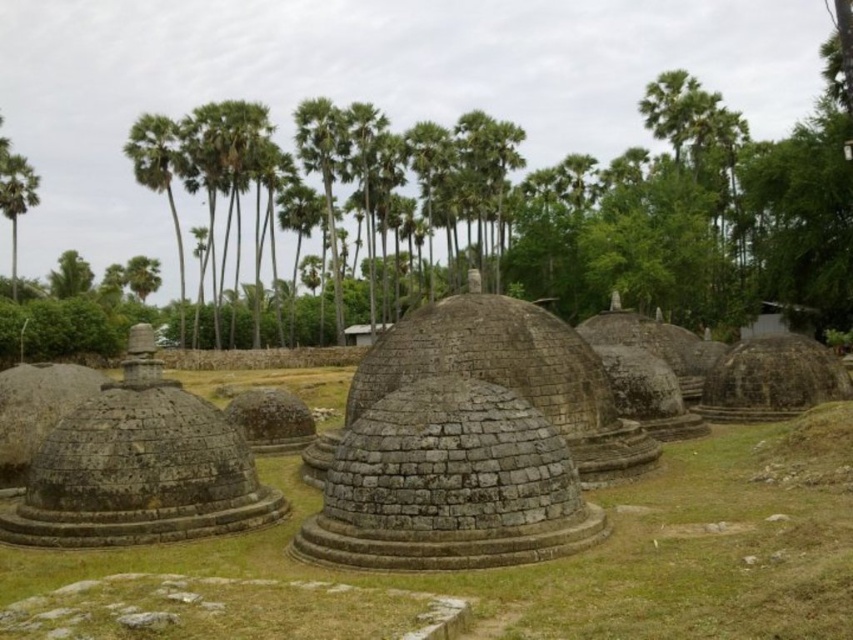
In the scene shown: Which is more to the left, green grass at center or green leafy palm tree at left?

From the viewer's perspective, green leafy palm tree at left appears more on the left side.

Find the location of a particular element. green grass at center is located at coordinates click(x=602, y=548).

The height and width of the screenshot is (640, 853). What do you see at coordinates (602, 548) in the screenshot?
I see `green grass at center` at bounding box center [602, 548].

Where is `green grass at center`? Image resolution: width=853 pixels, height=640 pixels. green grass at center is located at coordinates (602, 548).

Between point (26, 205) and point (759, 330), which one is positioned behind?

The point (26, 205) is more distant.

Which is above, green leafy palm tree at left or smooth gray stone hut at center?

Positioned higher is green leafy palm tree at left.

Measure the distance between point (18, 196) and camera.

104.55 meters

Identify the location of green leafy palm tree at left. (16, 198).

Which of these two, green grass at center or green leafy palm tree at center, stands shorter?

With less height is green grass at center.

Which of these two, green grass at center or green leafy palm tree at center, stands taller?

With more height is green leafy palm tree at center.

Where is `green grass at center`? green grass at center is located at coordinates (602, 548).